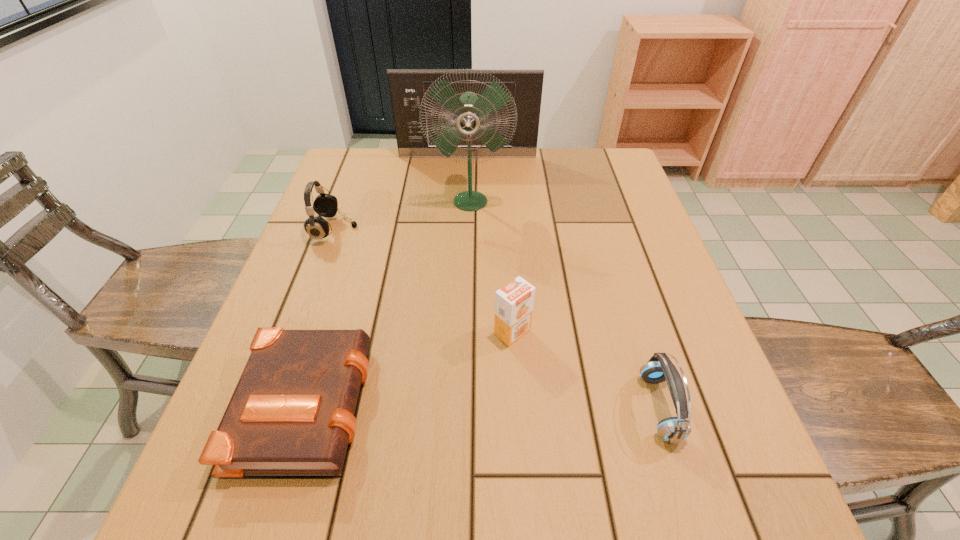
Locate an element on the screen. free spot between the rightmost object and the tallest object is located at coordinates (564, 304).

Where is `vacant space that's between the fan and the rightmost object`? The width and height of the screenshot is (960, 540). vacant space that's between the fan and the rightmost object is located at coordinates (564, 304).

Where is `vacant space that's between the orange juice and the left headset`? The height and width of the screenshot is (540, 960). vacant space that's between the orange juice and the left headset is located at coordinates (423, 281).

At what (x,y) coordinates should I click in order to perform the action: click on free space between the orange juice and the tallest object. Please return your answer as a coordinate pair (x, y). Looking at the image, I should click on (492, 266).

Locate an element on the screen. The height and width of the screenshot is (540, 960). free spot between the rightmost object and the farthest object is located at coordinates (564, 282).

Locate an element on the screen. The width and height of the screenshot is (960, 540). free point between the orange juice and the farthest object is located at coordinates (490, 244).

The image size is (960, 540). Find the location of `vacant area that lies between the fan and the taller headset`. vacant area that lies between the fan and the taller headset is located at coordinates (402, 215).

Where is `object that is the fifth closest one to the orange juice`? This screenshot has width=960, height=540. object that is the fifth closest one to the orange juice is located at coordinates click(x=407, y=87).

Where is `the fourth closest object relative to the microwave oven`? Image resolution: width=960 pixels, height=540 pixels. the fourth closest object relative to the microwave oven is located at coordinates (292, 412).

Find the location of a particular element. Image resolution: width=960 pixels, height=540 pixels. blank area in the image that satisfies the following two spatial constraints: 1. on the front panel of the farthest object; 2. with the microphone on the side of the taller headset is located at coordinates (465, 230).